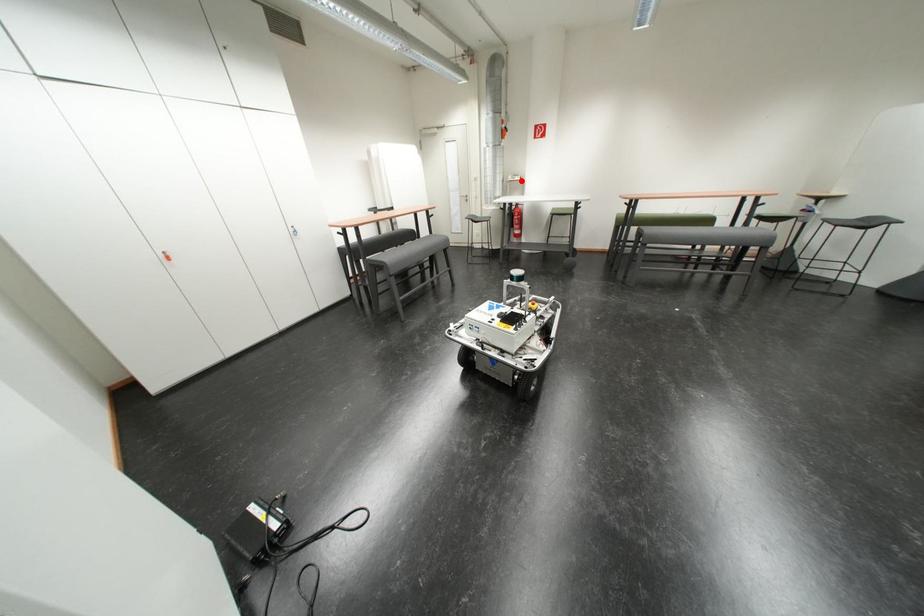
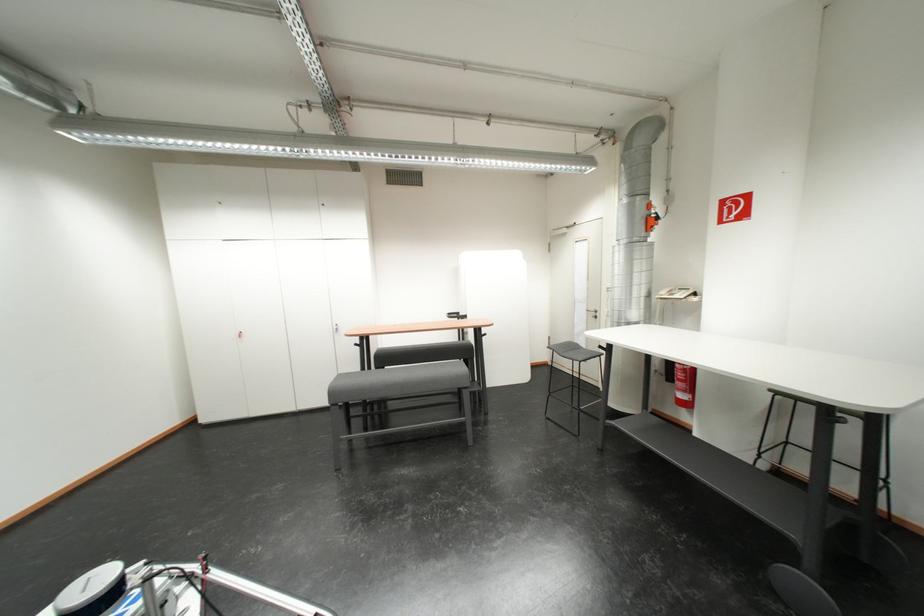
Question: I am providing you with two images of the same scene from different viewpoints. In image1, a red point is highlighted. Considering the same 3D point in image2, which of the following is correct?

Choices:
 (A) It is closer
 (B) It is farther

Answer: (B)